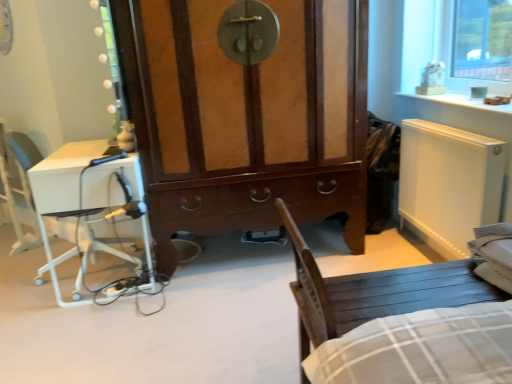
Where is `vacant space that's between brown wood cabinet at center and white glossy desk at left`? vacant space that's between brown wood cabinet at center and white glossy desk at left is located at coordinates [219, 284].